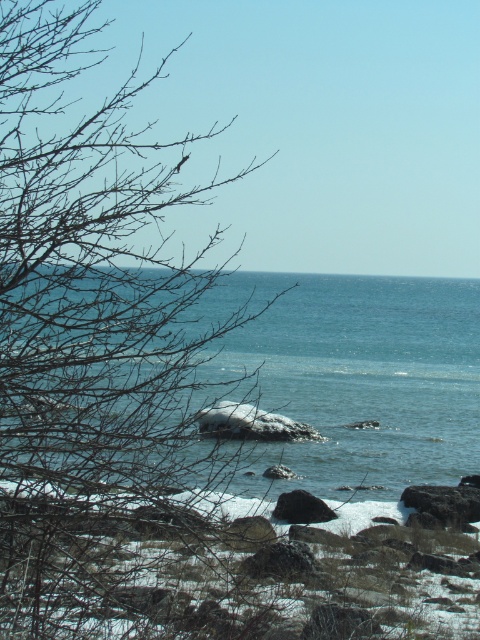
You are a hiker carrying a heavy backpack and need to cross from the smooth gray rock at lower right to the smooth gray rock at center. Can you safely step between them without falling into the water?

The smooth gray rock at lower right and smooth gray rock at center are 1.90 meters apart. Since the average person can step up to 1 meter, the distance is too large, so you might fall into the water.

You are a bird flying over the coastal scene. You want to land on the highest point between the bare branches at left and the blue water at center. Which one should you choose?

The bare branches at left is taller than the blue water at center, so you should land on the bare branches at left.